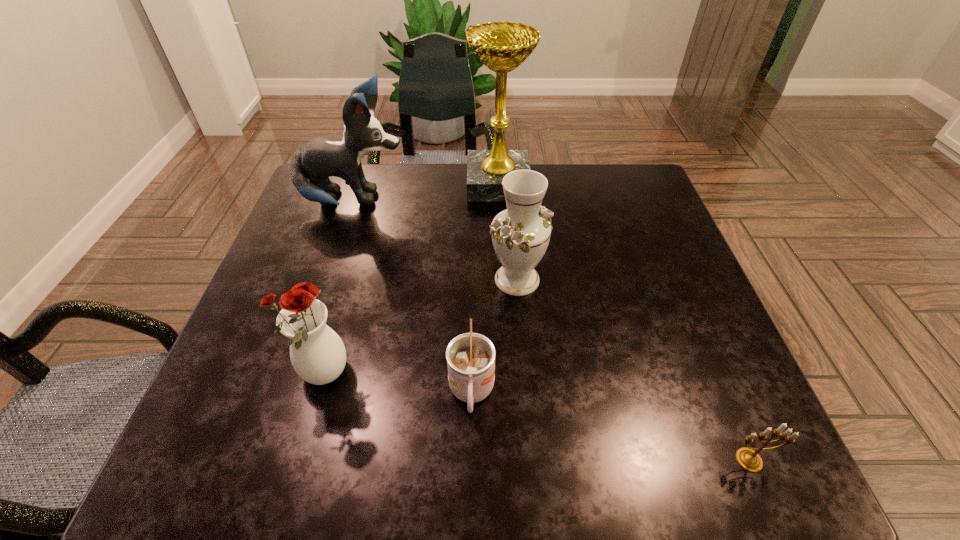
Locate an element on the screen. The width and height of the screenshot is (960, 540). free space at the near left corner of the desktop is located at coordinates (239, 475).

In the image, there is a desktop. Find the location of `vacant space at the far right corner`. vacant space at the far right corner is located at coordinates (601, 191).

The image size is (960, 540). Find the location of `unoccupied position between the puppy and the right vase`. unoccupied position between the puppy and the right vase is located at coordinates (436, 240).

Identify the location of free spot between the puppy and the farther vase. (436, 240).

Find the location of a particular element. This screenshot has width=960, height=540. free space between the award and the left vase is located at coordinates (411, 280).

What are the coordinates of `free space between the cup and the third farthest object` in the screenshot? It's located at (494, 336).

Locate an element on the screen. Image resolution: width=960 pixels, height=540 pixels. empty space that is in between the tallest object and the cup is located at coordinates (485, 288).

Locate an element on the screen. The width and height of the screenshot is (960, 540). free area in between the fifth shortest object and the nearest object is located at coordinates (552, 330).

The height and width of the screenshot is (540, 960). I want to click on free spot between the left vase and the cup, so click(x=397, y=384).

Where is `unoccupied area between the puppy and the award`? unoccupied area between the puppy and the award is located at coordinates (426, 192).